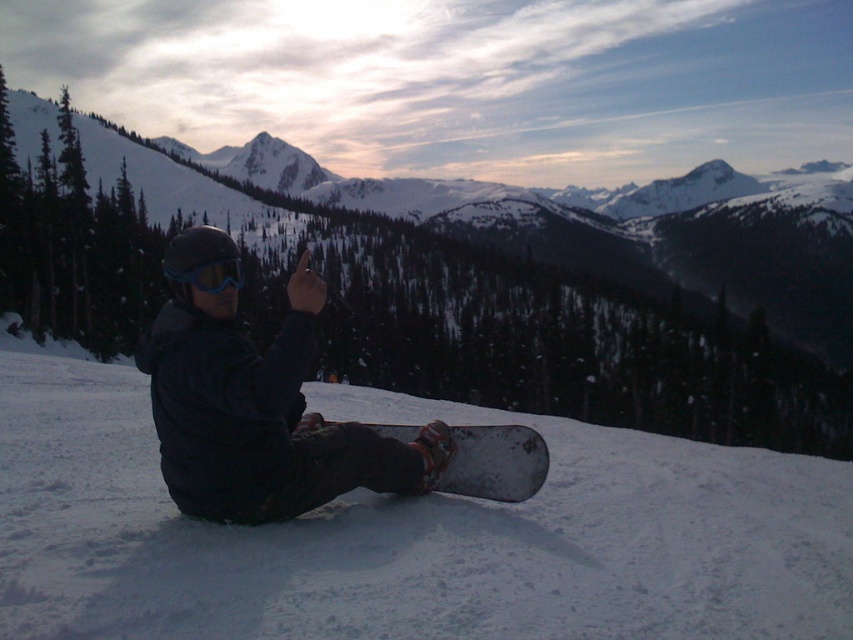
In the scene shown: Is white matte snowboard at center to the left of dark gray matte snowboard at lower center from the viewer's perspective?

Correct, you'll find white matte snowboard at center to the left of dark gray matte snowboard at lower center.

At what (x,y) coordinates should I click in order to perform the action: click on white matte snowboard at center. Please return your answer as a coordinate pair (x, y). Looking at the image, I should click on (409, 536).

Between point (270, 486) and point (440, 476), which one is positioned behind?

The point (440, 476) is behind.

Looking at this image, is matte black snowboarder at center positioned before dark gray matte snowboard at lower center?

Yes.

The height and width of the screenshot is (640, 853). What do you see at coordinates (260, 413) in the screenshot?
I see `matte black snowboarder at center` at bounding box center [260, 413].

Find the location of `matte black snowboarder at center`. matte black snowboarder at center is located at coordinates [260, 413].

Between matte black snowboarder at center and matte blue goggles at center, which one appears on the left side from the viewer's perspective?

From the viewer's perspective, matte blue goggles at center appears more on the left side.

Which is in front, point (285, 500) or point (221, 269)?

Point (221, 269) is in front.

Image resolution: width=853 pixels, height=640 pixels. Find the location of `matte black snowboarder at center`. matte black snowboarder at center is located at coordinates (260, 413).